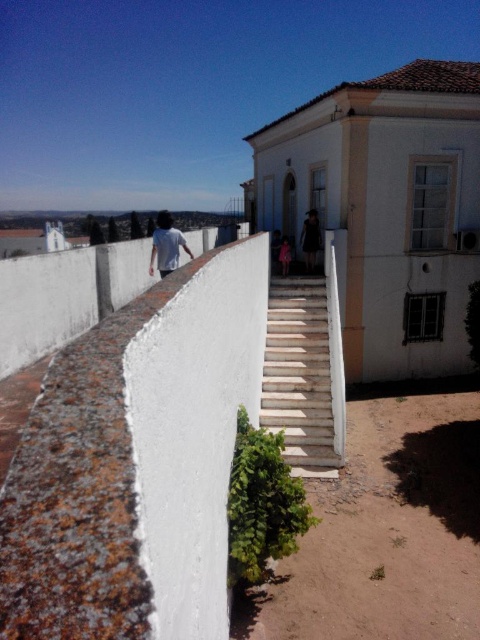
Question: Which point is closer to the camera taking this photo?

Choices:
 (A) pos(312,241)
 (B) pos(291,429)
 (C) pos(286,275)
 (D) pos(157,250)

Answer: (D)

Question: Observing the image, what is the correct spatial positioning of white concrete stairs at center in reference to white cotton shirt at center?

Choices:
 (A) right
 (B) left

Answer: (A)

Question: Which object is the farthest from the white cotton shirt at center?

Choices:
 (A) pink fabric dress at center
 (B) white concrete stairs at center
 (C) black fabric dress at center

Answer: (A)

Question: Which object is closer to the camera taking this photo?

Choices:
 (A) black fabric dress at center
 (B) white concrete stairs at center
 (C) white cotton shirt at center

Answer: (B)

Question: Considering the relative positions of black fabric dress at center and pink fabric dress at center in the image provided, where is black fabric dress at center located with respect to pink fabric dress at center?

Choices:
 (A) right
 (B) left

Answer: (A)

Question: Does white concrete stairs at center appear under white cotton shirt at center?

Choices:
 (A) yes
 (B) no

Answer: (A)